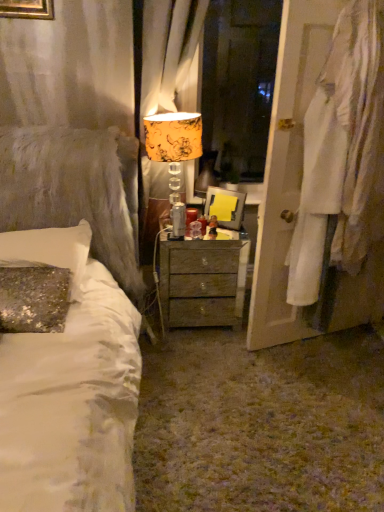
Question: From the image's perspective, is sequined fabric pillow at left beneath orange floral fabric curtain at upper center?

Choices:
 (A) yes
 (B) no

Answer: (A)

Question: Would you say sequined fabric pillow at left is a long distance from orange floral fabric curtain at upper center?

Choices:
 (A) yes
 (B) no

Answer: (B)

Question: Does sequined fabric pillow at left appear on the right side of orange floral fabric curtain at upper center?

Choices:
 (A) no
 (B) yes

Answer: (A)

Question: Is sequined fabric pillow at left placed right next to orange floral fabric curtain at upper center?

Choices:
 (A) no
 (B) yes

Answer: (A)

Question: Is sequined fabric pillow at left positioned with its back to orange floral fabric curtain at upper center?

Choices:
 (A) no
 (B) yes

Answer: (A)

Question: Is point (77, 274) positioned closer to the camera than point (301, 1)?

Choices:
 (A) closer
 (B) farther

Answer: (B)

Question: From a real-world perspective, is sequined fabric pillow at left above or below white fabric at right?

Choices:
 (A) above
 (B) below

Answer: (B)

Question: From the image's perspective, is sequined fabric pillow at left above or below white fabric at right?

Choices:
 (A) below
 (B) above

Answer: (A)

Question: In the image, is sequined fabric pillow at left positioned in front of or behind white fabric at right?

Choices:
 (A) front
 (B) behind

Answer: (B)

Question: From a real-world perspective, relative to white fabric at right, is yellow floral fabric lampshade at center vertically above or below?

Choices:
 (A) above
 (B) below

Answer: (A)

Question: Is point (190, 135) closer or farther from the camera than point (296, 169)?

Choices:
 (A) farther
 (B) closer

Answer: (A)

Question: In terms of width, does yellow floral fabric lampshade at center look wider or thinner when compared to white fabric at right?

Choices:
 (A) wide
 (B) thin

Answer: (A)

Question: Is yellow floral fabric lampshade at center inside the boundaries of white fabric at right, or outside?

Choices:
 (A) inside
 (B) outside

Answer: (B)

Question: From a real-world perspective, is wooden nightstand at center positioned above or below sequined fabric pillow at left?

Choices:
 (A) below
 (B) above

Answer: (A)

Question: From their relative heights in the image, would you say wooden nightstand at center is taller or shorter than sequined fabric pillow at left?

Choices:
 (A) tall
 (B) short

Answer: (A)